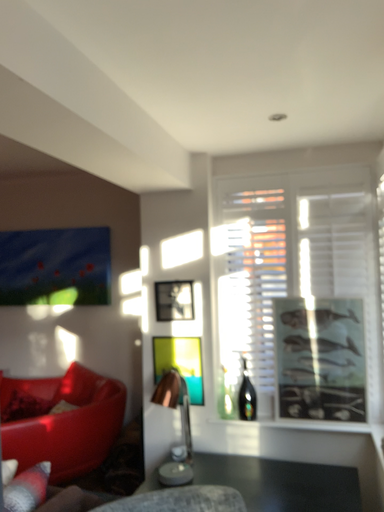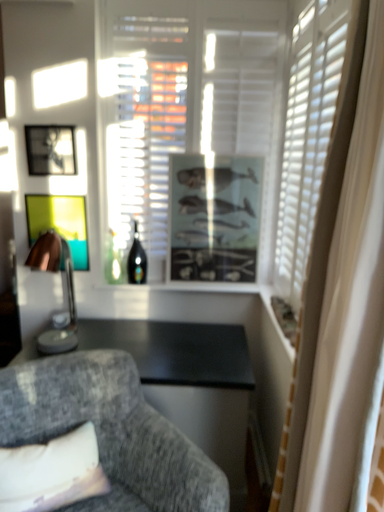
Question: Which way did the camera rotate in the video?

Choices:
 (A) rotated left
 (B) rotated right

Answer: (B)